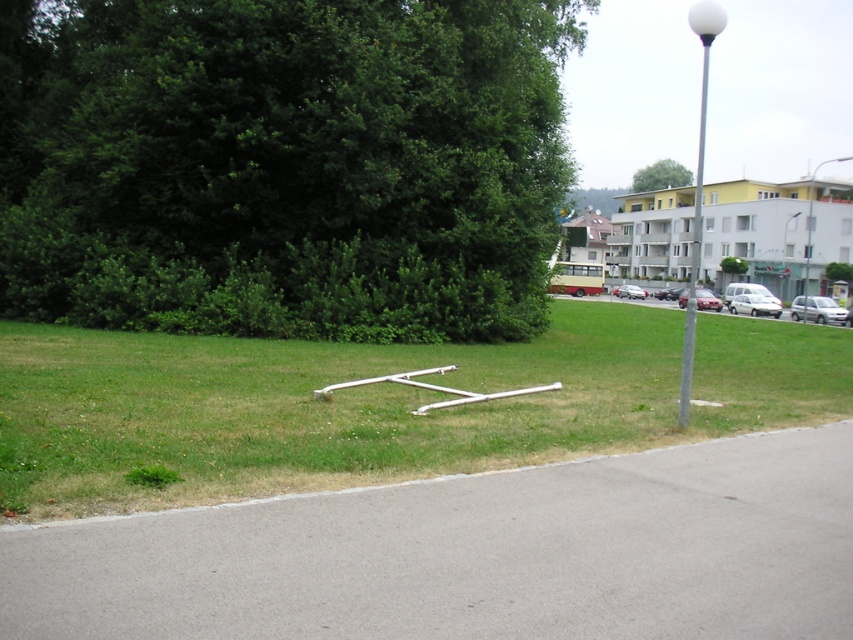
Question: Which of the following is the farthest from the observer?

Choices:
 (A) gray asphalt curb at lower left
 (B) white glossy sedan at center-right
 (C) shiny red car at center
 (D) metallic silver van at center

Answer: (D)

Question: Is silver metallic pole at right above green leafy tree at upper center?

Choices:
 (A) yes
 (B) no

Answer: (B)

Question: Among these points, which one is farthest from the camera?

Choices:
 (A) (744, 307)
 (B) (839, 323)
 (C) (616, 288)

Answer: (C)

Question: Which of these objects is positioned closest to the white glossy sedan at center-right?

Choices:
 (A) green leafy tree at upper left
 (B) green leafy tree at upper center

Answer: (A)

Question: Can you confirm if green grass at center is thinner than silver metallic van at center-right?

Choices:
 (A) yes
 (B) no

Answer: (B)

Question: Does silver metallic pole at right have a smaller size compared to green leafy tree at upper center?

Choices:
 (A) no
 (B) yes

Answer: (A)